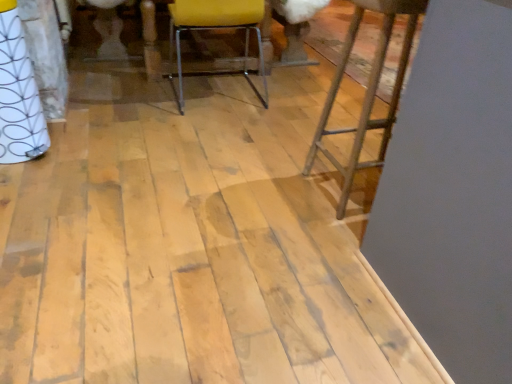
Locate an element on the screen. The width and height of the screenshot is (512, 384). vacant space underneath yellow fabric chair at center (from a real-world perspective) is located at coordinates (217, 96).